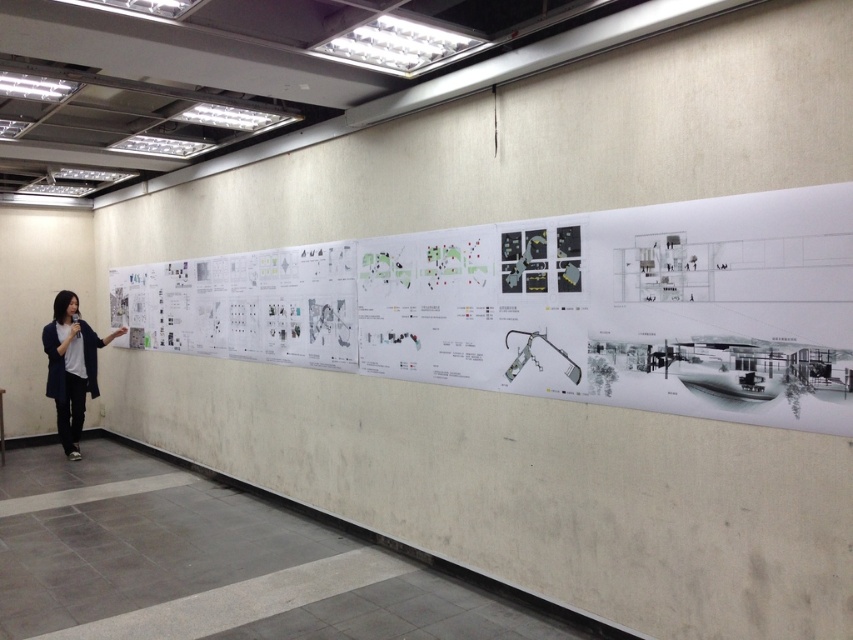
Question: Which point appears farthest from the camera in this image?

Choices:
 (A) (701, 304)
 (B) (96, 396)

Answer: (B)

Question: Is white paper at center to the right of dark blue fabric jacket at left from the viewer's perspective?

Choices:
 (A) yes
 (B) no

Answer: (A)

Question: Which object appears closest to the camera in this image?

Choices:
 (A) white paper at center
 (B) dark blue fabric jacket at left

Answer: (A)

Question: Is white paper at center thinner than dark blue fabric jacket at left?

Choices:
 (A) no
 (B) yes

Answer: (A)

Question: Can you confirm if white paper at center is smaller than dark blue fabric jacket at left?

Choices:
 (A) yes
 (B) no

Answer: (B)

Question: Among these points, which one is nearest to the camera?

Choices:
 (A) (548, 291)
 (B) (80, 332)

Answer: (A)